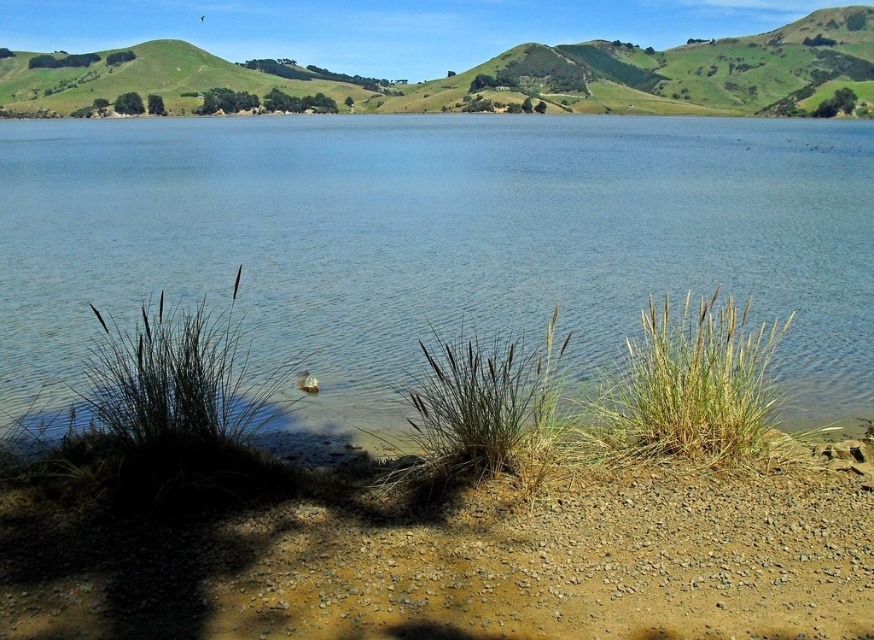
Between brown grass at lower center and white fluffy duck at lower center, which one has less height?

white fluffy duck at lower center

Is brown grass at lower center above white fluffy duck at lower center?

Correct, brown grass at lower center is located above white fluffy duck at lower center.

Is point (460, 349) farther from viewer compared to point (304, 388)?

Yes, it is behind point (304, 388).

You are a GUI agent. You are given a task and a screenshot of the screen. Output one action in this format:
    pyautogui.click(x=<x>, y=<y>)
    Task: Click on the brown grass at lower center
    The height and width of the screenshot is (640, 874).
    Given the screenshot: What is the action you would take?
    pyautogui.click(x=479, y=412)

Is clear blue water at center positioned before green grassy hill at upper left?

Yes, it is.

Based on the photo, can you confirm if clear blue water at center is smaller than green grassy hill at upper left?

No.

Is point (108, 193) closer to viewer compared to point (177, 42)?

Yes, it is in front of point (177, 42).

Find the location of a particular element. Image resolution: width=874 pixels, height=640 pixels. clear blue water at center is located at coordinates (437, 241).

Is green grassy hill at upper center positioned in front of green grass at lower right?

No, it is not.

Which is behind, point (0, 20) or point (736, 342)?

Point (0, 20)

I want to click on green grassy hill at upper center, so click(442, 61).